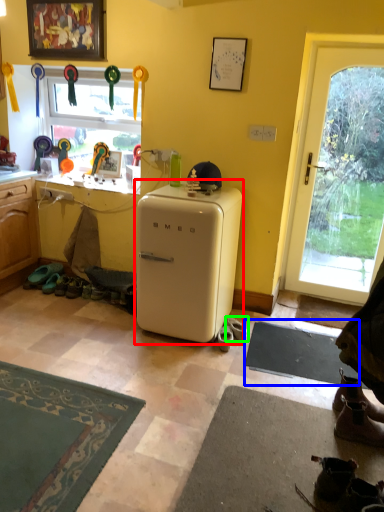
Question: Which object is positioned farthest from refrigerator (highlighted by a red box)? Select from yoga mat (highlighted by a blue box) and footwear (highlighted by a green box).

Choices:
 (A) yoga mat
 (B) footwear

Answer: (A)